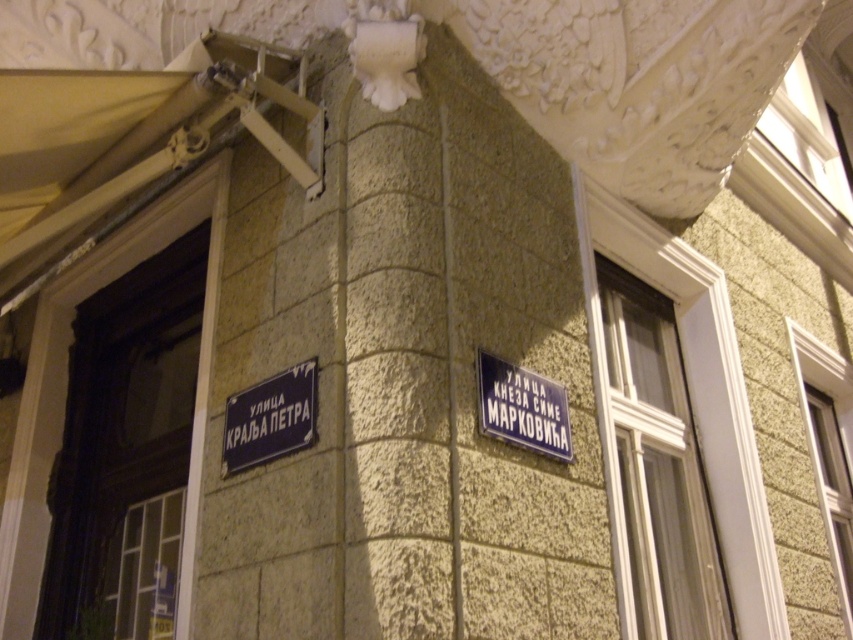
Question: Does dark blue metal street sign at lower left appear on the left side of blue metallic sign at upper right?

Choices:
 (A) yes
 (B) no

Answer: (A)

Question: Is dark blue metal street sign at lower left wider than blue metallic sign at upper right?

Choices:
 (A) no
 (B) yes

Answer: (B)

Question: Among these points, which one is farthest from the camera?

Choices:
 (A) (312, 404)
 (B) (567, 422)

Answer: (B)

Question: In this image, where is dark blue metal street sign at lower left located relative to blue metallic sign at upper right?

Choices:
 (A) below
 (B) above

Answer: (A)

Question: Among these objects, which one is farthest from the camera?

Choices:
 (A) blue metallic sign at upper right
 (B) dark blue metal street sign at lower left

Answer: (A)